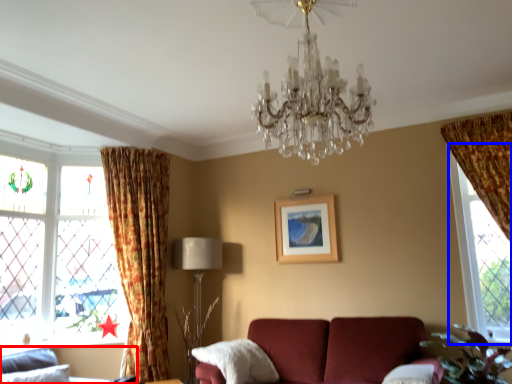
Question: Which of the following is the closest to the observer, studio couch (highlighted by a red box) or window (highlighted by a blue box)?

Choices:
 (A) studio couch
 (B) window

Answer: (A)